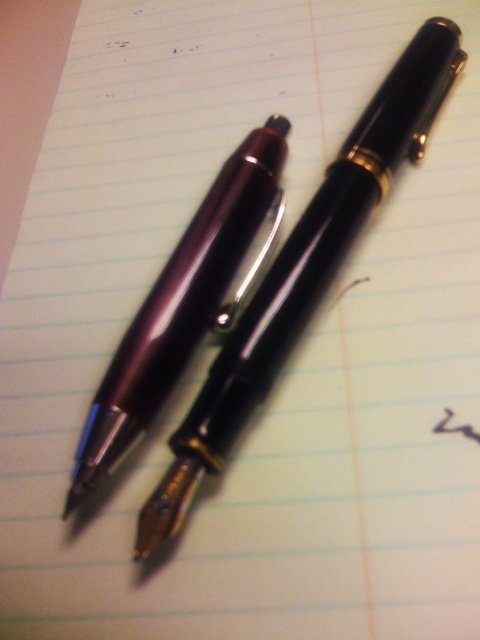
Question: Which point is closer to the camera?

Choices:
 (A) (208, 410)
 (B) (177, 372)

Answer: (A)

Question: Which object appears closest to the camera in this image?

Choices:
 (A) matte purple pen at center
 (B) matte black pen at upper center

Answer: (B)

Question: Does matte black pen at upper center have a lesser width compared to matte purple pen at center?

Choices:
 (A) no
 (B) yes

Answer: (A)

Question: Does matte black pen at upper center come in front of matte purple pen at center?

Choices:
 (A) yes
 (B) no

Answer: (A)

Question: Does matte black pen at upper center have a lesser width compared to matte purple pen at center?

Choices:
 (A) no
 (B) yes

Answer: (A)